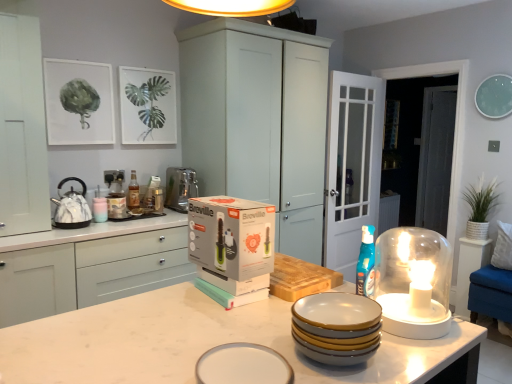
Question: Is white matte cabinet at left, placed as the third cabinetry when sorted from right to left, positioned behind transparent glass door at right, positioned as the second glass door in front-to-back order?

Choices:
 (A) yes
 (B) no

Answer: (B)

Question: From a real-world perspective, is white matte cabinet at left, the 1th cabinetry from the left, physically above transparent glass door at right, marked as the 1th glass door in a right-to-left arrangement?

Choices:
 (A) yes
 (B) no

Answer: (A)

Question: Can you confirm if white matte cabinet at left, placed as the third cabinetry when sorted from right to left, is wider than transparent glass door at right, marked as the 1th glass door in a right-to-left arrangement?

Choices:
 (A) yes
 (B) no

Answer: (A)

Question: Is white matte cabinet at left, placed as the third cabinetry when sorted from right to left, turned away from transparent glass door at right, placed as the 2th glass door when sorted from left to right?

Choices:
 (A) yes
 (B) no

Answer: (B)

Question: From a real-world perspective, is white matte cabinet at left, the 1th cabinetry from the left, physically below transparent glass door at right, positioned as the second glass door in front-to-back order?

Choices:
 (A) no
 (B) yes

Answer: (A)

Question: Looking at their shapes, would you say matte ceramic candle holder at left, which appears as the second candle holder when viewed from the right, is wider or thinner than matte glass bottle at upper left?

Choices:
 (A) thin
 (B) wide

Answer: (A)

Question: Looking at the image, does matte ceramic candle holder at left, the 2th candle holder from the front, seem bigger or smaller compared to matte glass bottle at upper left?

Choices:
 (A) big
 (B) small

Answer: (B)

Question: Choose the correct answer: Is matte ceramic candle holder at left, the 2th candle holder from the front, inside matte glass bottle at upper left or outside it?

Choices:
 (A) inside
 (B) outside

Answer: (B)

Question: Is matte ceramic candle holder at left, marked as the 1th candle holder in a back-to-front arrangement, to the left or to the right of matte glass bottle at upper left in the image?

Choices:
 (A) left
 (B) right

Answer: (A)

Question: Is green leafy plant in white pot at right, positioned as the 2th plant in top-to-bottom order, spatially inside white matte cabinet at center, marked as the 1th cabinetry in a right-to-left arrangement, or outside of it?

Choices:
 (A) outside
 (B) inside

Answer: (A)

Question: From the image's perspective, is green leafy plant in white pot at right, arranged as the first plant when ordered from the bottom, above or below white matte cabinet at center, acting as the 3th cabinetry starting from the left?

Choices:
 (A) above
 (B) below

Answer: (B)

Question: Is point (494, 183) positioned closer to the camera than point (210, 110)?

Choices:
 (A) closer
 (B) farther

Answer: (B)

Question: Based on their sizes in the image, would you say green leafy plant in white pot at right, positioned as the 2th plant in top-to-bottom order, is bigger or smaller than white matte cabinet at center, acting as the 3th cabinetry starting from the left?

Choices:
 (A) small
 (B) big

Answer: (A)

Question: Is clear glass door at center, which appears as the first glass door when viewed from the front, to the left or to the right of white glossy table at right in the image?

Choices:
 (A) left
 (B) right

Answer: (A)

Question: From a real-world perspective, is clear glass door at center, which appears as the first glass door when viewed from the front, physically located above or below white glossy table at right?

Choices:
 (A) above
 (B) below

Answer: (A)